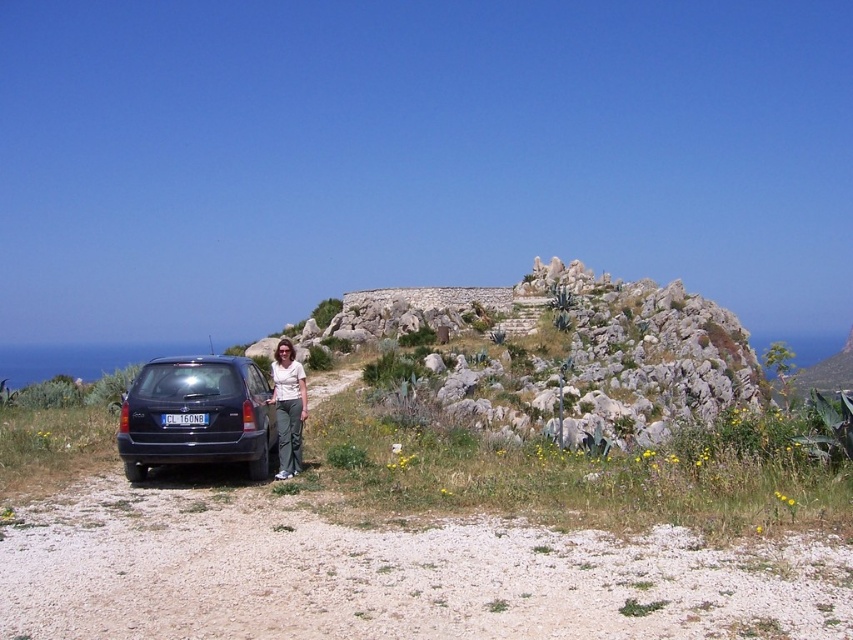
Question: Does shiny dark blue suv at center have a lesser width compared to matte white shirt at center?

Choices:
 (A) no
 (B) yes

Answer: (A)

Question: Which is nearer to the matte white shirt at center?

Choices:
 (A) shiny dark blue suv at center
 (B) blue plastic license plate at center

Answer: (A)

Question: Where is rocky stone hillside at center located in relation to blue plastic license plate at center in the image?

Choices:
 (A) below
 (B) above

Answer: (B)

Question: Can you confirm if matte white shirt at center is positioned above blue plastic license plate at center?

Choices:
 (A) yes
 (B) no

Answer: (B)

Question: Estimate the real-world distances between objects in this image. Which object is closer to the blue plastic license plate at center?

Choices:
 (A) shiny dark blue suv at center
 (B) matte white shirt at center

Answer: (A)

Question: Which object appears closest to the camera in this image?

Choices:
 (A) rocky stone hillside at center
 (B) shiny dark blue suv at center
 (C) matte white shirt at center
 (D) blue plastic license plate at center

Answer: (B)